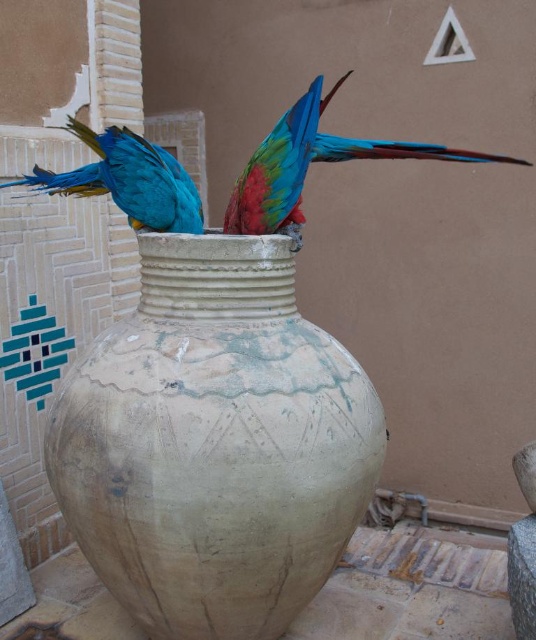
You are an architect designing a virtual reality environment based on the scene. You need to place a virtual marker exactly where the earthy clay vase at center is located. What are the coordinates for placing the marker?

The coordinates for placing the virtual marker should be at point (x=214, y=444), as that is the 2D location of the earthy clay vase at center.

You are standing in a garden and want to water the earthy clay vase at center. If your watering can has a maximum reach of 1.5 meters, can you reach the vase without moving closer?

The earthy clay vase at center is 1.62 meters away from the viewer, which exceeds the watering can reach of 1.5 meters. Therefore, you cannot reach the vase without moving closer.

You are standing in front of the beige ceramic pot and looking at the two parrots. Which parrot is nearer to you, the shiny blue parrot at upper center or the blue glossy parrot at upper center?

The shiny blue parrot at upper center is closer to the viewer than the blue glossy parrot at upper center.